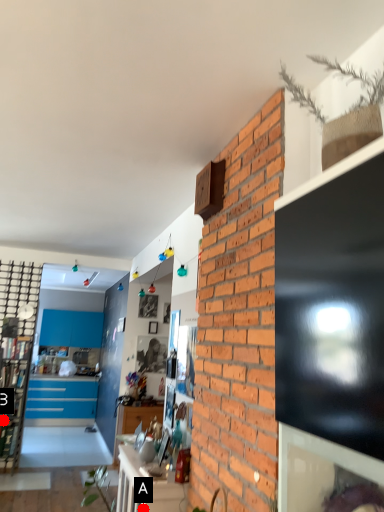
Question: Two points are circled on the image, labeled by A and B beside each circle. Which point is closer to the camera?

Choices:
 (A) A is closer
 (B) B is closer

Answer: (A)